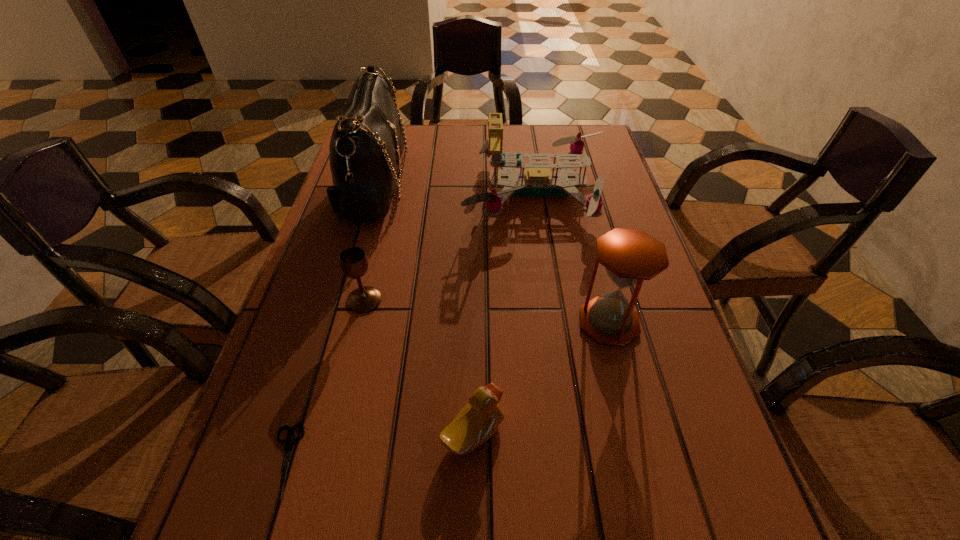
Find the location of a particular element. The height and width of the screenshot is (540, 960). vacant space situated on the left of the hourglass is located at coordinates (390, 322).

The height and width of the screenshot is (540, 960). Find the location of `free space located on the back of the chalice`. free space located on the back of the chalice is located at coordinates (376, 250).

Identify the location of vacant area situated at the beak of the duck. This screenshot has height=540, width=960. (693, 433).

Identify the location of free space located 0.280m on the right of the shortest object. (475, 461).

At what (x,y) coordinates should I click in order to perform the action: click on handbag that is at the far edge. Please return your answer as a coordinate pair (x, y). Looking at the image, I should click on (367, 143).

Image resolution: width=960 pixels, height=540 pixels. I want to click on drone located at the far edge, so click(538, 180).

At what (x,y) coordinates should I click in order to perform the action: click on handbag located in the left edge section of the desktop. Please return your answer as a coordinate pair (x, y). Looking at the image, I should click on click(x=367, y=143).

Locate an element on the screen. The width and height of the screenshot is (960, 540). chalice that is at the left edge is located at coordinates (353, 260).

You are a GUI agent. You are given a task and a screenshot of the screen. Output one action in this format:
    pyautogui.click(x=<x>, y=<y>)
    Task: Click on the shears that is at the left edge
    This screenshot has height=540, width=960.
    Given the screenshot: What is the action you would take?
    [x=288, y=442]

At what (x,y) coordinates should I click in order to perform the action: click on drone positioned at the right edge. Please return your answer as a coordinate pair (x, y). Looking at the image, I should click on (538, 180).